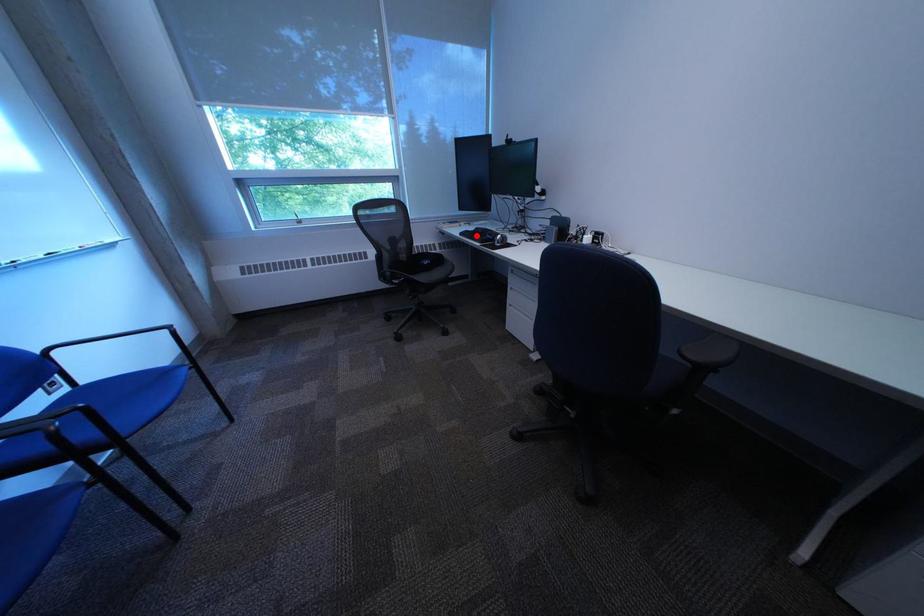
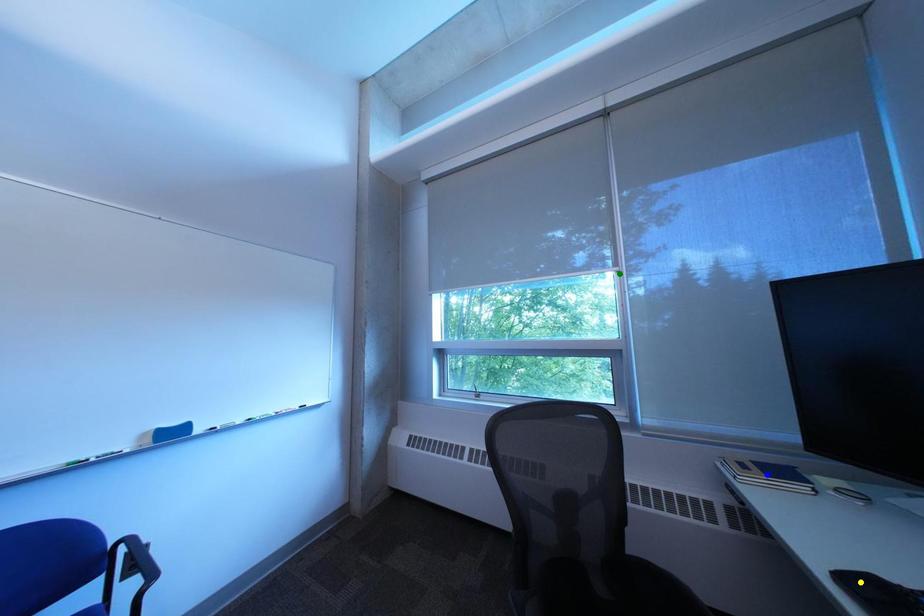
Question: I am providing you with two images of the same scene from different viewpoints. A red point is marked on the first image. You are given multiple points on the second image. Which point in image 2 is actually the same real-world point as the red point in image 1?

Choices:
 (A) green point
 (B) blue point
 (C) yellow point

Answer: (C)